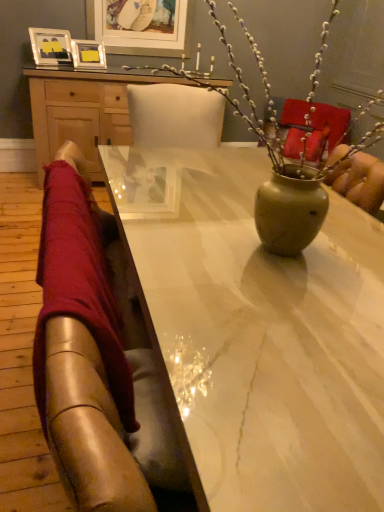
Locate an element on the screen. free region under matte green vase at center (from a real-world perspective) is located at coordinates click(289, 256).